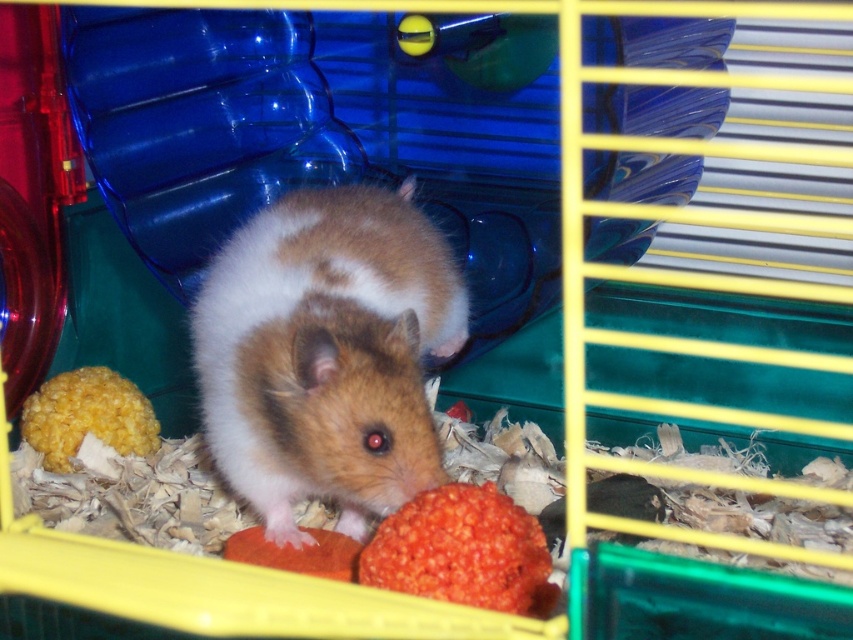
What is the location of the point labeled as [326,353] in the hamster cage?

The point labeled as [326,353] is located on the brown fuzzy hamster at center.